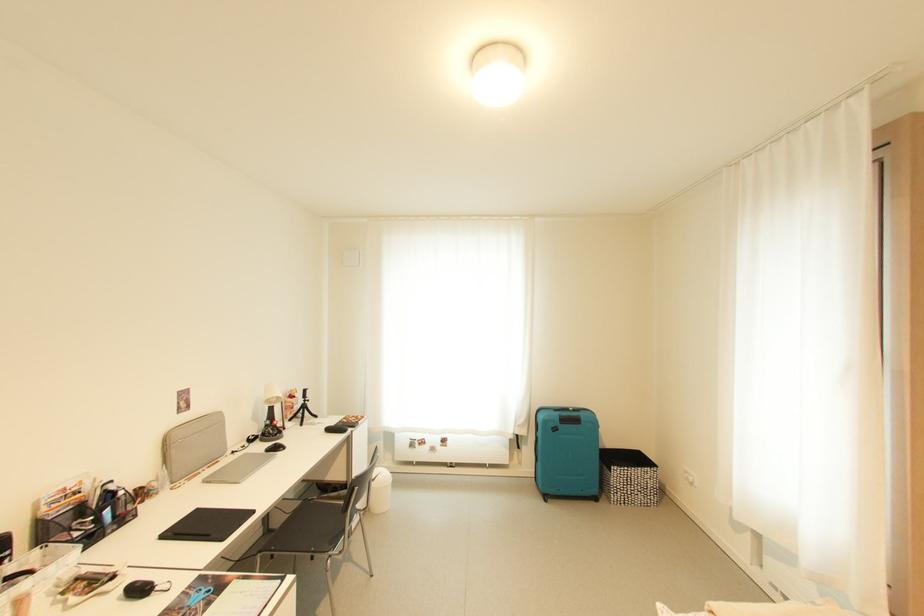
This screenshot has width=924, height=616. Identify the location of black drawing tablet. (207, 525).